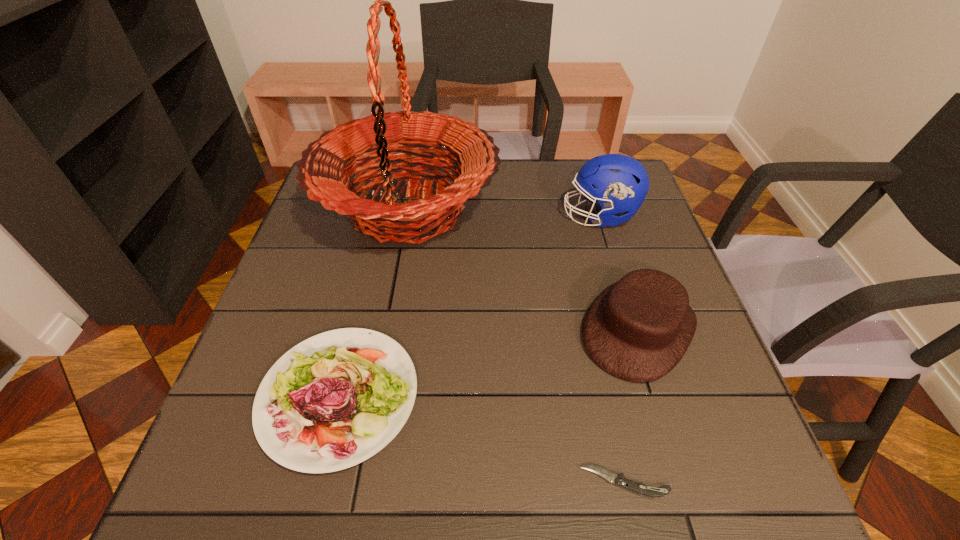
The width and height of the screenshot is (960, 540). Identify the location of pocketknife that is at the right edge. (619, 480).

Identify the location of object at the far left corner. click(322, 173).

Find the location of a particular element. Image resolution: width=960 pixels, height=540 pixels. object present at the near left corner is located at coordinates (367, 377).

Identify the location of object present at the far right corner. (619, 183).

This screenshot has height=540, width=960. I want to click on object present at the near right corner, so click(x=619, y=480).

This screenshot has width=960, height=540. In order to click on free spot at the far edge of the desktop in this screenshot , I will do `click(516, 188)`.

In the image, there is a desktop. At what (x,y) coordinates should I click in order to perform the action: click on vacant space at the near edge. Please return your answer as a coordinate pair (x, y). The height and width of the screenshot is (540, 960). Looking at the image, I should click on (548, 464).

What are the coordinates of `vacant space at the left edge` in the screenshot? It's located at (223, 426).

This screenshot has width=960, height=540. Find the location of `vacant space at the right edge of the desktop`. vacant space at the right edge of the desktop is located at coordinates (617, 259).

Locate an element on the screen. This screenshot has width=960, height=540. empty space that is in between the pocketknife and the hat is located at coordinates (632, 406).